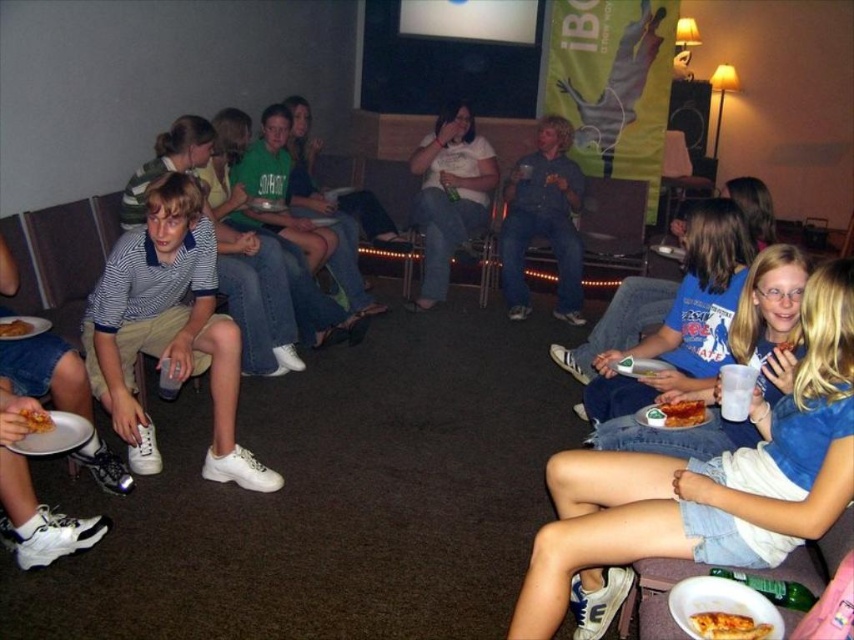
You are standing at the center of the room looking towards the large screen. Where would you see the denim shorts at lower right located relative to your position?

The denim shorts at lower right are located at the lower right relative to your position when facing the large screen.

You are a photographer standing at the entrance of the room. You want to take a photo of the denim shorts at lower right and the golden crispy pizza slice at lower right without any obstruction. Based on their heights, which object should you focus on first to ensure it appears clearly in the foreground?

The denim shorts at lower right is much taller than the golden crispy pizza slice at lower right, so you should focus on the denim shorts at lower right first to ensure it appears clearly in the foreground.